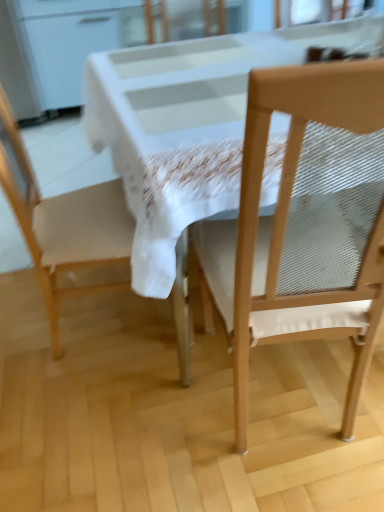
Question: Is wooden chair at right, acting as the 1th chair starting from the right, next to white glossy table at center?

Choices:
 (A) no
 (B) yes

Answer: (A)

Question: From a real-world perspective, is wooden chair at right, marked as the second chair in a left-to-right arrangement, below white glossy table at center?

Choices:
 (A) no
 (B) yes

Answer: (A)

Question: Can you confirm if wooden chair at right, acting as the 1th chair starting from the right, is wider than white glossy table at center?

Choices:
 (A) yes
 (B) no

Answer: (B)

Question: From the image's perspective, does wooden chair at right, marked as the second chair in a left-to-right arrangement, appear lower than white glossy table at center?

Choices:
 (A) yes
 (B) no

Answer: (A)

Question: Does wooden chair at right, marked as the second chair in a left-to-right arrangement, appear on the right side of white glossy table at center?

Choices:
 (A) no
 (B) yes

Answer: (A)

Question: Is white glossy table at center situated inside matte white chair at left, positioned as the first chair in left-to-right order, or outside?

Choices:
 (A) inside
 (B) outside

Answer: (B)

Question: Considering their positions, is white glossy table at center located in front of or behind matte white chair at left, which appears as the 2th chair when viewed from the right?

Choices:
 (A) behind
 (B) front

Answer: (B)

Question: Is white glossy table at center to the left or to the right of matte white chair at left, which appears as the 2th chair when viewed from the right, in the image?

Choices:
 (A) left
 (B) right

Answer: (B)

Question: Looking at their shapes, would you say white glossy table at center is wider or thinner than matte white chair at left, positioned as the first chair in left-to-right order?

Choices:
 (A) wide
 (B) thin

Answer: (A)

Question: Considering the relative positions of matte white chair at left, which appears as the 2th chair when viewed from the right, and wooden chair at right, marked as the second chair in a left-to-right arrangement, in the image provided, is matte white chair at left, which appears as the 2th chair when viewed from the right, to the left or to the right of wooden chair at right, marked as the second chair in a left-to-right arrangement,?

Choices:
 (A) right
 (B) left

Answer: (B)

Question: Looking at their shapes, would you say matte white chair at left, positioned as the first chair in left-to-right order, is wider or thinner than wooden chair at right, acting as the 1th chair starting from the right?

Choices:
 (A) thin
 (B) wide

Answer: (A)

Question: From the image's perspective, is matte white chair at left, which appears as the 2th chair when viewed from the right, positioned above or below wooden chair at right, marked as the second chair in a left-to-right arrangement?

Choices:
 (A) above
 (B) below

Answer: (A)

Question: In the image, is matte white chair at left, positioned as the first chair in left-to-right order, positioned in front of or behind wooden chair at right, marked as the second chair in a left-to-right arrangement?

Choices:
 (A) behind
 (B) front

Answer: (A)

Question: From the image's perspective, relative to matte white chair at left, positioned as the first chair in left-to-right order, is wooden chair at right, acting as the 1th chair starting from the right, above or below?

Choices:
 (A) below
 (B) above

Answer: (A)

Question: Considering the positions of point (382, 172) and point (23, 165), is point (382, 172) closer or farther from the camera than point (23, 165)?

Choices:
 (A) farther
 (B) closer

Answer: (B)